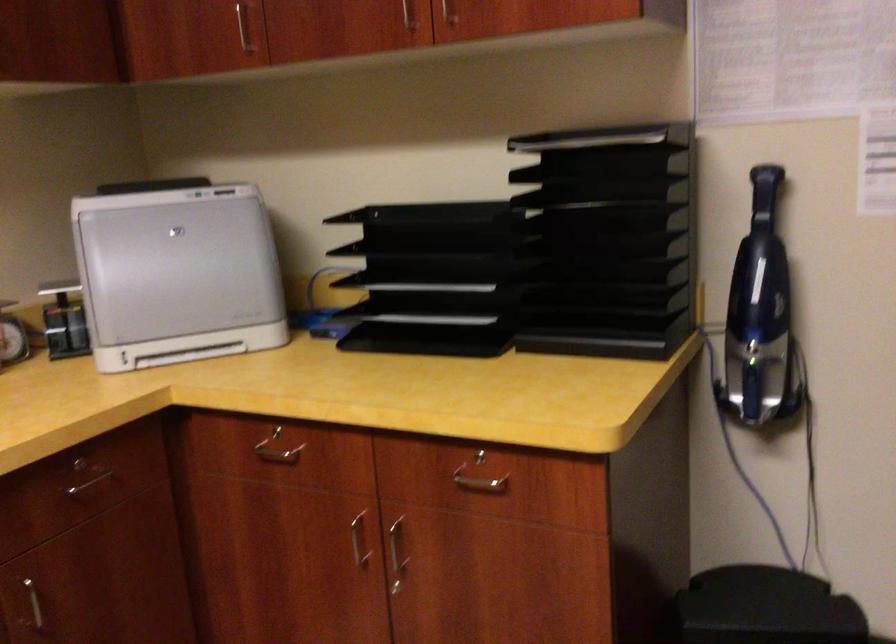
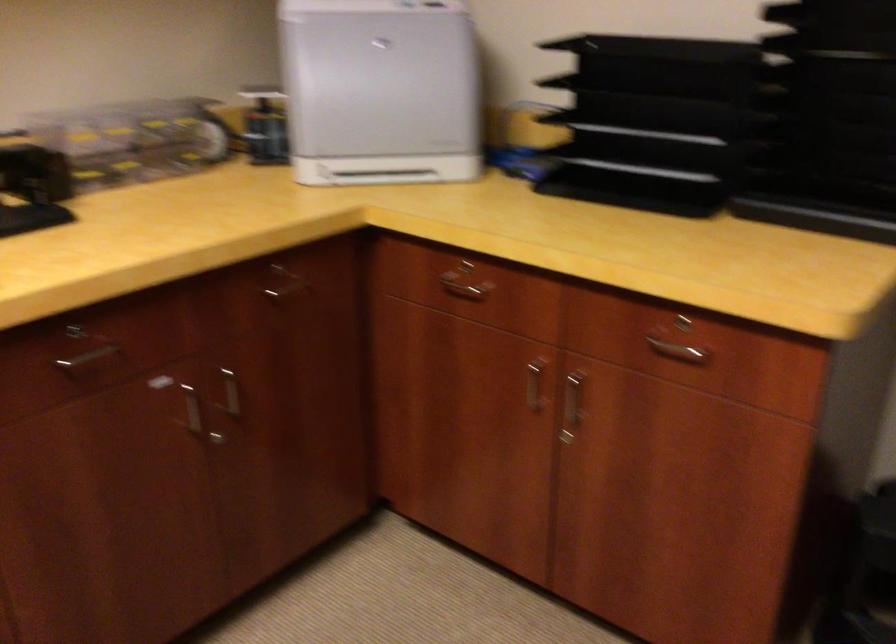
Locate, in the second image, the point that corresponds to point (485, 456) in the first image.

(686, 321)